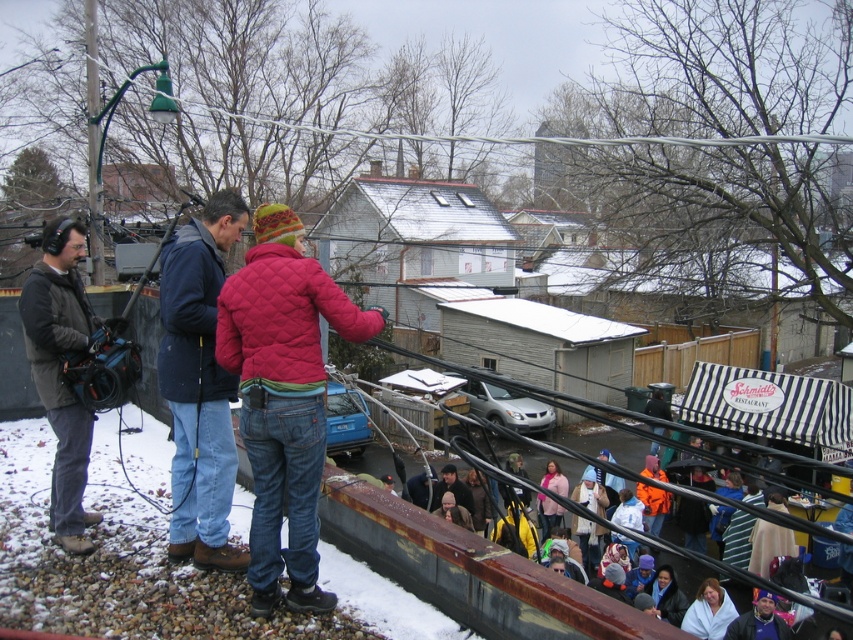
From the picture: Is the position of dark blue jacket at center less distant than that of matte pink jacket at center?

Yes, dark blue jacket at center is in front of matte pink jacket at center.

How distant is dark blue jacket at center from matte pink jacket at center?

They are 31.43 feet apart.

Which is behind, point (189, 513) or point (480, 515)?

The point (480, 515) is more distant.

What are the coordinates of `dark blue jacket at center` in the screenshot? It's located at (199, 385).

Between dark blue jacket at center and dark brown leather jacket at lower center, which one has more height?

dark blue jacket at center is taller.

Who is positioned more to the left, dark blue jacket at center or dark brown leather jacket at lower center?

From the viewer's perspective, dark blue jacket at center appears more on the left side.

Find the location of a particular element. The width and height of the screenshot is (853, 640). dark blue jacket at center is located at coordinates (199, 385).

Image resolution: width=853 pixels, height=640 pixels. Find the location of `dark blue jacket at center`. dark blue jacket at center is located at coordinates (199, 385).

Describe the element at coordinates (548, 515) in the screenshot. Image resolution: width=853 pixels, height=640 pixels. I see `pink matte jacket at lower center` at that location.

Is pink matte jacket at lower center shorter than matte pink jacket at center?

Correct, pink matte jacket at lower center is not as tall as matte pink jacket at center.

Between point (553, 524) and point (476, 490), which one is positioned behind?

The point (476, 490) is more distant.

The height and width of the screenshot is (640, 853). I want to click on pink matte jacket at lower center, so click(548, 515).